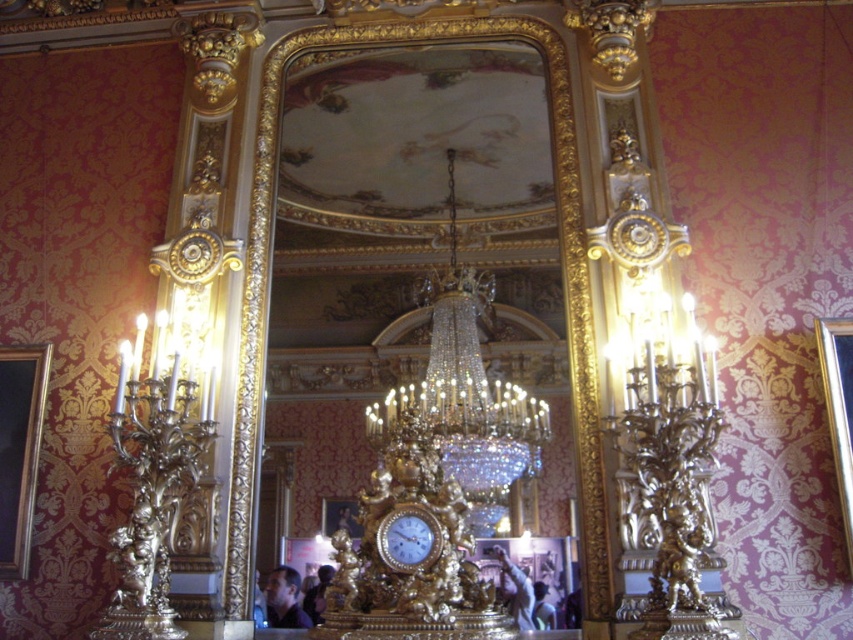
Question: Which of the following is the closest to the observer?

Choices:
 (A) gold textured frame at center
 (B) dark skin human at center
 (C) smooth skin face at center
 (D) gold metallic clock at center

Answer: (D)

Question: Is smooth skin face at center above gold textured frame at center?

Choices:
 (A) no
 (B) yes

Answer: (A)

Question: Considering the relative positions of dark blue fabric at center and dark skin human at center in the image provided, where is dark blue fabric at center located with respect to dark skin human at center?

Choices:
 (A) left
 (B) right

Answer: (A)

Question: Is wooden picture frame at left closer to the viewer compared to dark blue fabric at center?

Choices:
 (A) yes
 (B) no

Answer: (A)

Question: Which point appears closest to the camera in this image?

Choices:
 (A) (277, 580)
 (B) (318, 588)
 (C) (519, 611)
 (D) (840, 461)

Answer: (D)

Question: Considering the real-world distances, which object is farthest from the dark blue fabric at center?

Choices:
 (A) gold metallic clock at center
 (B) crystal/glass chandelier at center
 (C) smooth skin face at center

Answer: (A)